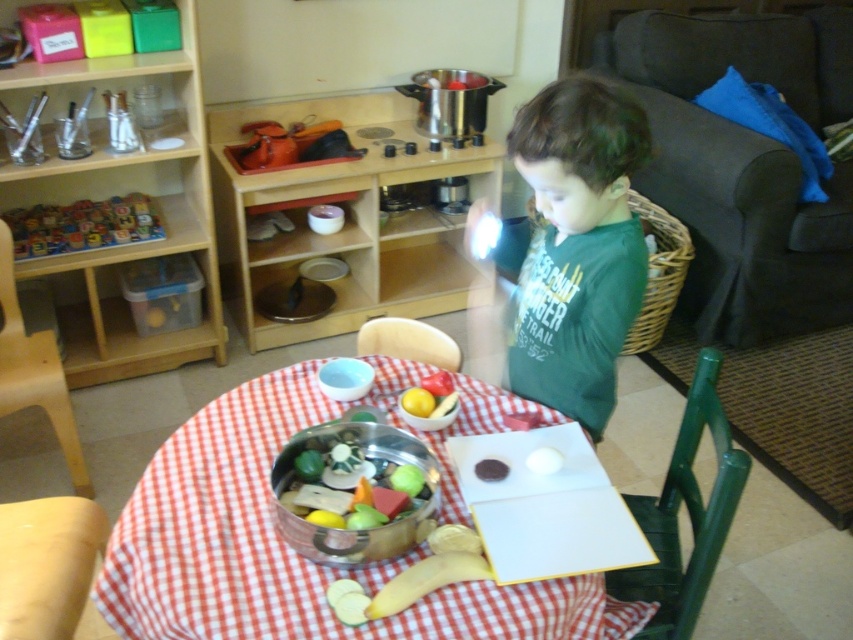
Question: Does checkered fabric table at center come in front of shiny metallic pot at center?

Choices:
 (A) no
 (B) yes

Answer: (B)

Question: Can you confirm if green cotton shirt at center is positioned below smooth brown cookie at center?

Choices:
 (A) yes
 (B) no

Answer: (B)

Question: Which point is farther from the camera taking this photo?

Choices:
 (A) (433, 445)
 (B) (494, 474)
 (C) (386, 525)
 (D) (621, 193)

Answer: (A)

Question: Among these objects, which one is nearest to the camera?

Choices:
 (A) green cotton shirt at center
 (B) shiny metallic pot at center
 (C) smooth brown cookie at center

Answer: (B)

Question: Which of the following is the closest to the observer?

Choices:
 (A) shiny metallic pot at center
 (B) green cotton shirt at center
 (C) checkered fabric table at center
 (D) smooth brown cookie at center

Answer: (C)

Question: Is shiny metallic pot at center closer to camera compared to smooth brown cookie at center?

Choices:
 (A) no
 (B) yes

Answer: (B)